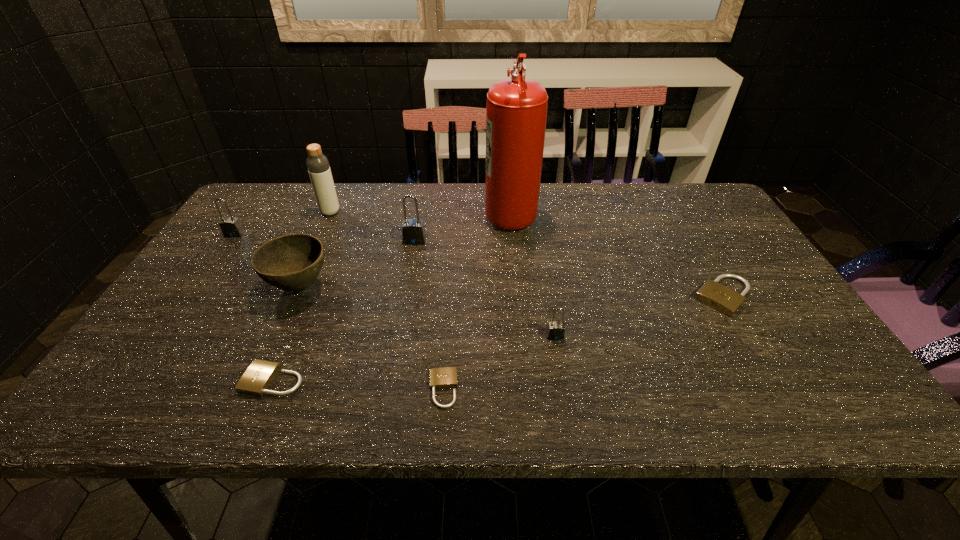
At what (x,y) coordinates should I click in order to perform the action: click on the sixth tallest object. Please return your answer as a coordinate pair (x, y). The width and height of the screenshot is (960, 540). Looking at the image, I should click on (555, 330).

You are a GUI agent. You are given a task and a screenshot of the screen. Output one action in this format:
    pyautogui.click(x=<x>, y=<y>)
    Task: Click on the biggest beige padlock
    
    Given the screenshot: What is the action you would take?
    pyautogui.click(x=721, y=298)

Locate an element on the screen. The height and width of the screenshot is (540, 960). the farthest beige padlock is located at coordinates click(721, 298).

What are the coordinates of `the fifth padlock from right to left` in the screenshot? It's located at 257,378.

Identify the location of the fifth tallest padlock. This screenshot has width=960, height=540. (257, 378).

You are a GUI agent. You are given a task and a screenshot of the screen. Output one action in this format:
    pyautogui.click(x=<x>, y=<y>)
    Task: Click on the second beige padlock from left to right
    Image resolution: width=960 pixels, height=540 pixels.
    Given the screenshot: What is the action you would take?
    tap(446, 377)

At what (x,y) coordinates should I click in order to perform the action: click on the shortest padlock. Please return your answer as a coordinate pair (x, y). The height and width of the screenshot is (540, 960). Looking at the image, I should click on (446, 377).

Where is `vacant region located on the instruction side of the fire extinguisher`? Image resolution: width=960 pixels, height=540 pixels. vacant region located on the instruction side of the fire extinguisher is located at coordinates [x=421, y=213].

The width and height of the screenshot is (960, 540). I want to click on free space located on the instruction side of the fire extinguisher, so click(x=446, y=213).

Where is `blank area located on the instruction side of the fire extinguisher`? The width and height of the screenshot is (960, 540). blank area located on the instruction side of the fire extinguisher is located at coordinates (460, 213).